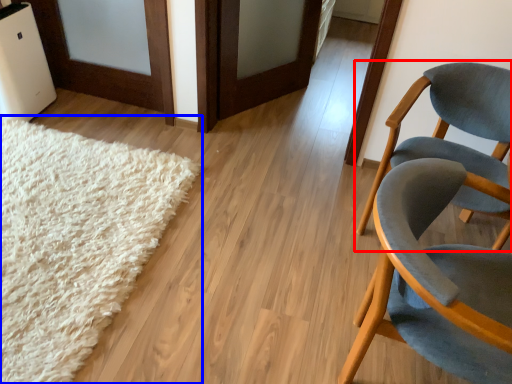
Question: Which of the following is the farthest to the observer, chair (highlighted by a red box) or mat (highlighted by a blue box)?

Choices:
 (A) chair
 (B) mat

Answer: (A)